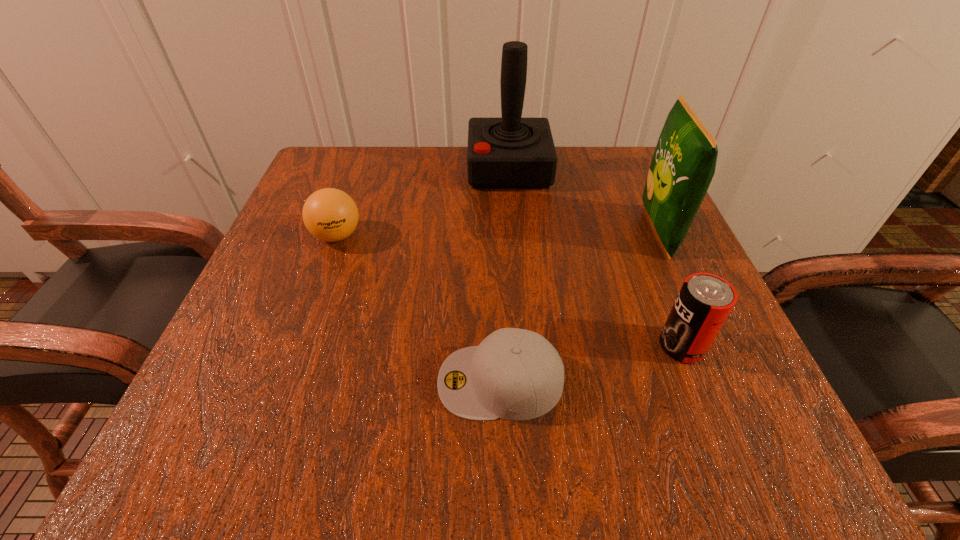
The image size is (960, 540). In the image, there is a desktop. In order to click on vacant region at the near right corner in this screenshot , I will do `click(695, 417)`.

Where is `free space between the shortest object and the crisp (potato chip)`? free space between the shortest object and the crisp (potato chip) is located at coordinates (579, 306).

I want to click on free space between the shortest object and the farthest object, so click(504, 275).

This screenshot has width=960, height=540. In order to click on vacant space that is in between the leftmost object and the cap in this screenshot , I will do `click(419, 308)`.

At what (x,y) coordinates should I click in order to perform the action: click on free space between the can and the shortest object. Please return your answer as a coordinate pair (x, y). This screenshot has width=960, height=540. Looking at the image, I should click on (590, 363).

The width and height of the screenshot is (960, 540). Find the location of `vacant space in between the leftmost object and the can`. vacant space in between the leftmost object and the can is located at coordinates (509, 291).

Find the location of a particular element. This screenshot has width=960, height=540. free space between the crisp (potato chip) and the ping-pong ball is located at coordinates 497,234.

Locate an element on the screen. free area in between the third tallest object and the farthest object is located at coordinates (595, 257).

The image size is (960, 540). What are the coordinates of `free space between the can and the shortest object` in the screenshot? It's located at (590, 363).

At what (x,y) coordinates should I click in order to perform the action: click on vacant space in between the cap and the crisp (potato chip). Please return your answer as a coordinate pair (x, y). This screenshot has width=960, height=540. Looking at the image, I should click on (579, 306).